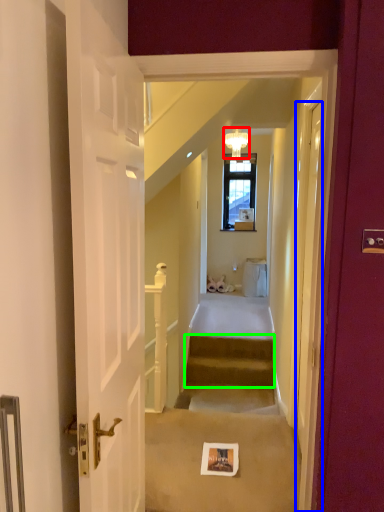
Question: Estimate the real-world distances between objects in this image. Which object is closer to light fixture (highlighted by a red box), door (highlighted by a blue box) or stairs (highlighted by a green box)?

Choices:
 (A) door
 (B) stairs

Answer: (B)